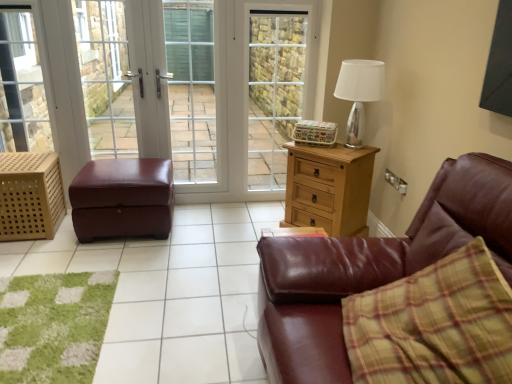
Question: Can we say silver metallic table lamp at upper right lies outside clear glass screen door at center, the 2th screen door viewed from the left?

Choices:
 (A) yes
 (B) no

Answer: (A)

Question: From the image's perspective, is silver metallic table lamp at upper right on clear glass screen door at center, which is the 1th screen door in right-to-left order?

Choices:
 (A) yes
 (B) no

Answer: (B)

Question: Does silver metallic table lamp at upper right touch clear glass screen door at center, which is the 1th screen door in right-to-left order?

Choices:
 (A) no
 (B) yes

Answer: (A)

Question: Does silver metallic table lamp at upper right have a smaller size compared to clear glass screen door at center, which is the 1th screen door in right-to-left order?

Choices:
 (A) no
 (B) yes

Answer: (B)

Question: Is silver metallic table lamp at upper right bigger than clear glass screen door at center, which is the 1th screen door in right-to-left order?

Choices:
 (A) no
 (B) yes

Answer: (A)

Question: From a real-world perspective, is silver metallic table lamp at upper right physically above clear glass screen door at center, the 2th screen door viewed from the left?

Choices:
 (A) yes
 (B) no

Answer: (A)

Question: From a real-world perspective, is clear glass door at center located higher than brown leather ottoman at left?

Choices:
 (A) yes
 (B) no

Answer: (A)

Question: From the image's perspective, is clear glass door at center over brown leather ottoman at left?

Choices:
 (A) yes
 (B) no

Answer: (A)

Question: Is the position of clear glass door at center more distant than that of brown leather ottoman at left?

Choices:
 (A) no
 (B) yes

Answer: (B)

Question: Is clear glass door at center facing towards brown leather ottoman at left?

Choices:
 (A) yes
 (B) no

Answer: (A)

Question: Is clear glass door at center positioned with its back to brown leather ottoman at left?

Choices:
 (A) no
 (B) yes

Answer: (B)

Question: From the image's perspective, is clear glass door at center under brown leather ottoman at left?

Choices:
 (A) yes
 (B) no

Answer: (B)

Question: Does clear glass door at center have a greater height compared to brown leather ottoman at center?

Choices:
 (A) yes
 (B) no

Answer: (A)